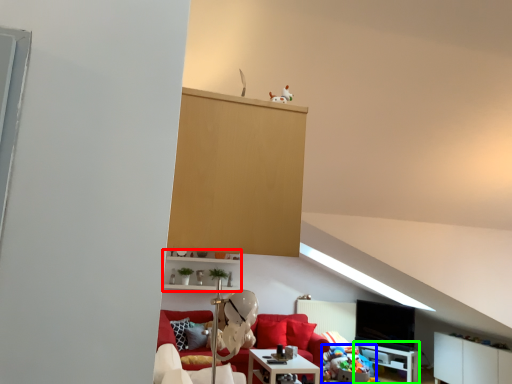
Question: Which object is the closest to the shelf (highlighted by a red box)? Choose among these: stuff (highlighted by a blue box) or table (highlighted by a green box).

Choices:
 (A) stuff
 (B) table

Answer: (A)